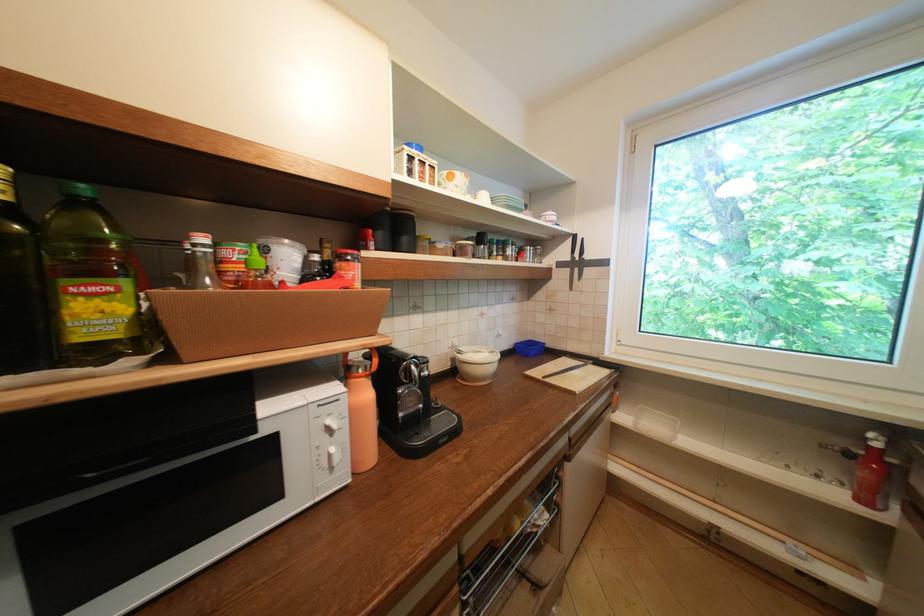
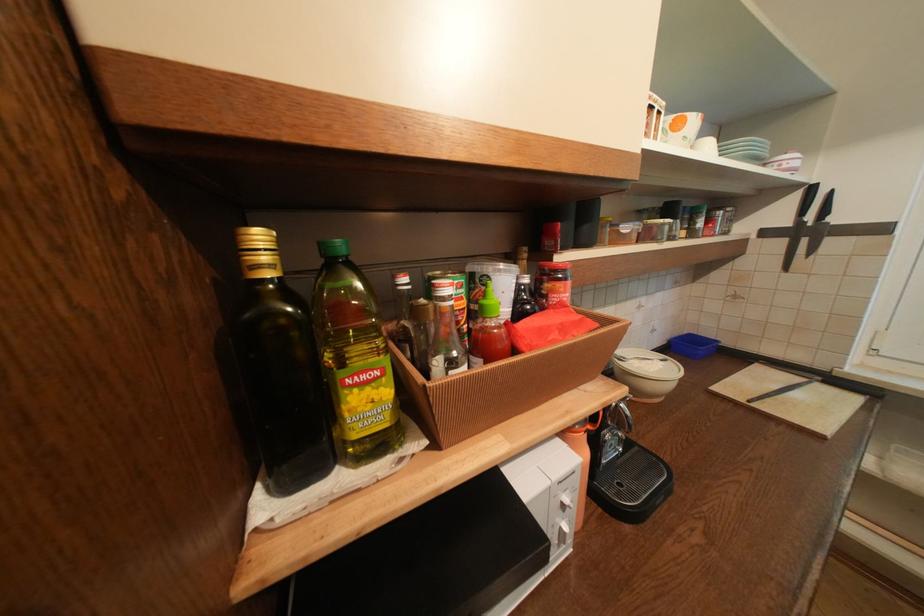
Where in the second image is the point corresponding to the point at 585,270 from the first image?

(812, 241)